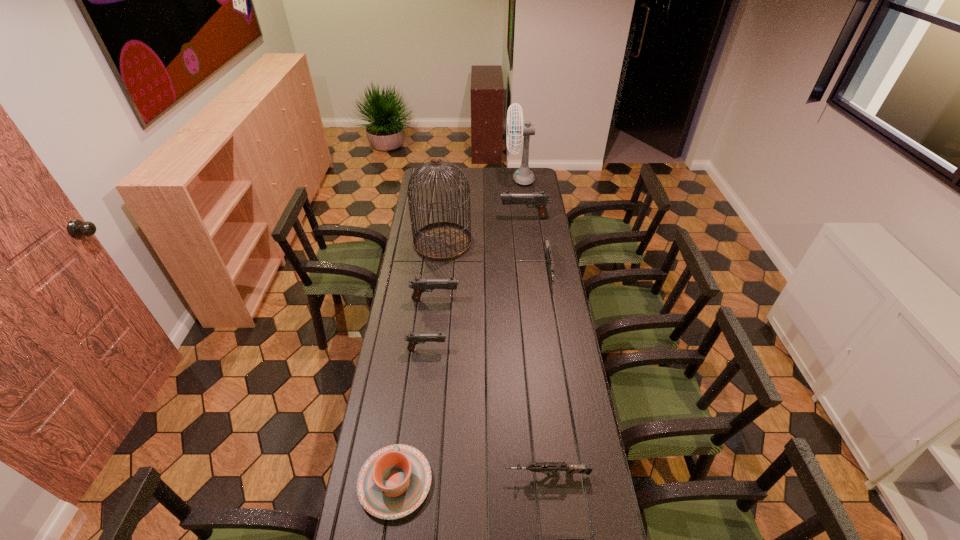
The width and height of the screenshot is (960, 540). I want to click on gun that stands as the fourth closest to the biggest gray gun, so click(553, 467).

Locate which gray gun is the second closest to the pink chinaware. Please provide its 2D coordinates. Your answer should be formatted as a tuple, i.e. [(x, y)], where the tuple contains the x and y coordinates of a point satisfying the conditions above.

[(419, 285)]

Identify the location of gray gun that can be found as the third closest to the pink chinaware. (539, 200).

Choose which grey gun is the nearest neighbor to the gray fan. Please provide its 2D coordinates. Your answer should be formatted as a tuple, i.e. [(x, y)], where the tuple contains the x and y coordinates of a point satisfying the conditions above.

[(546, 240)]

Identify which grey gun is located as the third nearest to the fifth nearest object. Please provide its 2D coordinates. Your answer should be formatted as a tuple, i.e. [(x, y)], where the tuple contains the x and y coordinates of a point satisfying the conditions above.

[(582, 539)]

Where is `vacant space that satisfies the following two spatial constraints: 1. aimed along the barrel of the farthest grey gun; 2. in the direction the nearest gray gun is aimed`? Image resolution: width=960 pixels, height=540 pixels. vacant space that satisfies the following two spatial constraints: 1. aimed along the barrel of the farthest grey gun; 2. in the direction the nearest gray gun is aimed is located at coordinates (563, 349).